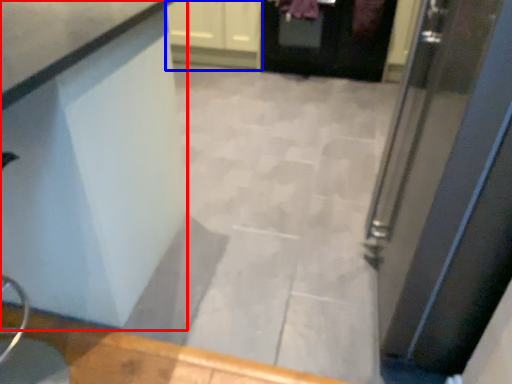
Question: Which point is closer to the camera, counter (highlighted by a red box) or cabinetry (highlighted by a blue box)?

Choices:
 (A) counter
 (B) cabinetry

Answer: (A)